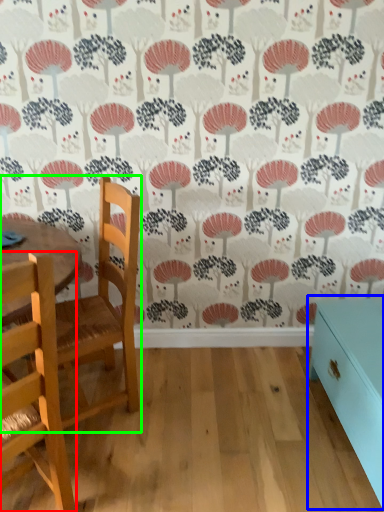
Question: Which object is positioned farthest from chair (highlighted by a red box)? Select from table (highlighted by a blue box) and chair (highlighted by a green box).

Choices:
 (A) table
 (B) chair

Answer: (A)